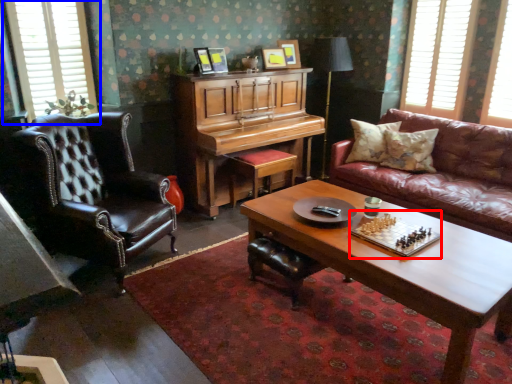
Question: Which object is further to the camera taking this photo, board game (highlighted by a red box) or window (highlighted by a blue box)?

Choices:
 (A) board game
 (B) window

Answer: (B)